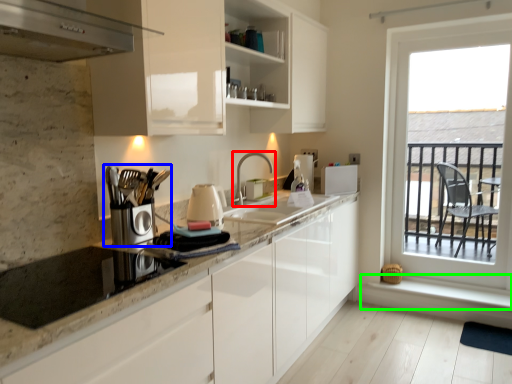
Question: Based on their relative distances, which object is nearer to tap (highlighted by a red box)? Choose from coffee machine (highlighted by a blue box) and window sill (highlighted by a green box).

Choices:
 (A) coffee machine
 (B) window sill

Answer: (A)